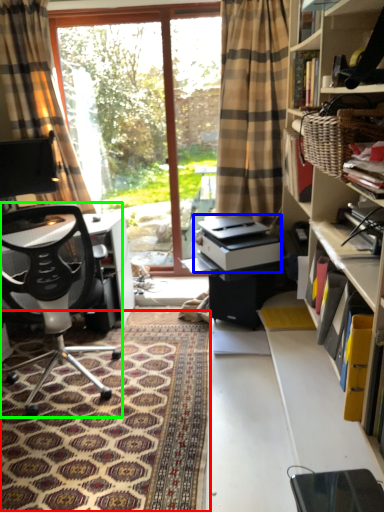
Question: Which is nearer to the mat (highlighted by a red box)? printer (highlighted by a blue box) or chair (highlighted by a green box).

Choices:
 (A) printer
 (B) chair

Answer: (B)